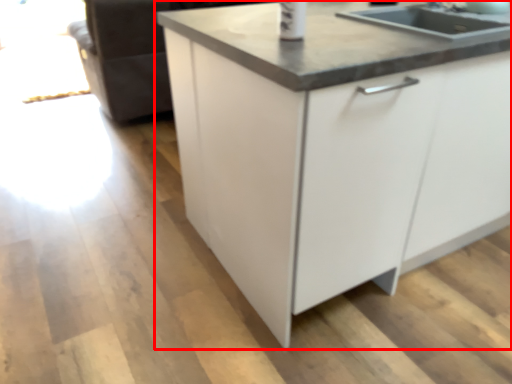
Question: Observing the image, what is the correct spatial positioning of cabinetry (annotated by the red box) in reference to countertop?

Choices:
 (A) right
 (B) left

Answer: (A)